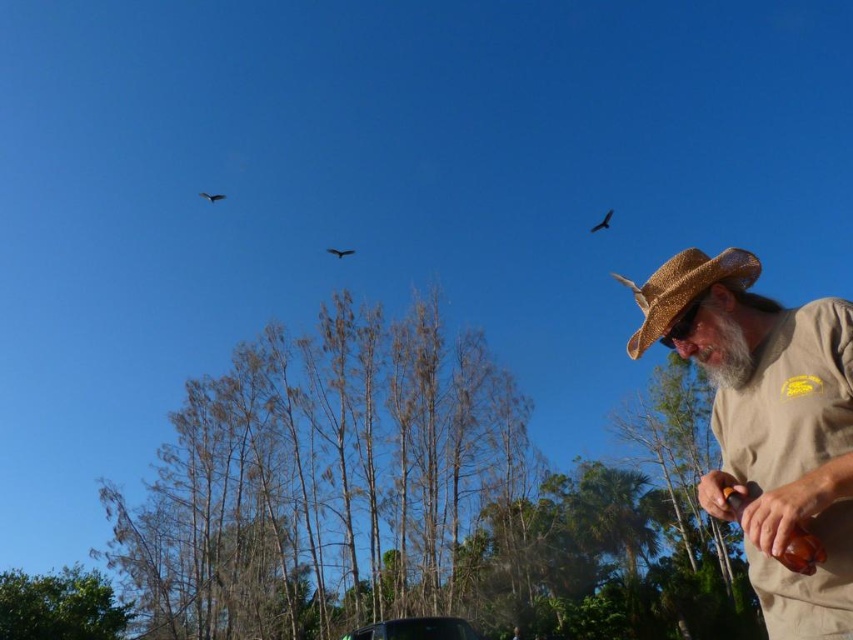
Question: From the image, what is the correct spatial relationship of dark brown feathers at upper right in relation to dark brown feathers at upper left?

Choices:
 (A) below
 (B) above

Answer: (A)

Question: Which of the following is the closest to the observer?

Choices:
 (A) dark brown feathers at upper right
 (B) dark brown feathers at upper left

Answer: (B)

Question: Which point is closer to the camera?

Choices:
 (A) tan straw hat at right
 (B) straw hat at right

Answer: (A)

Question: Does straw hat at right have a larger size compared to dark brown feathers at upper right?

Choices:
 (A) yes
 (B) no

Answer: (B)

Question: Considering the real-world distances, which object is farthest from the tan straw hat at right?

Choices:
 (A) dark brown feathers at center
 (B) dark brown feathers at upper left
 (C) dark brown feathers at upper right

Answer: (B)

Question: Is dark brown feathers at center to the left of dark brown feathers at upper left from the viewer's perspective?

Choices:
 (A) yes
 (B) no

Answer: (B)